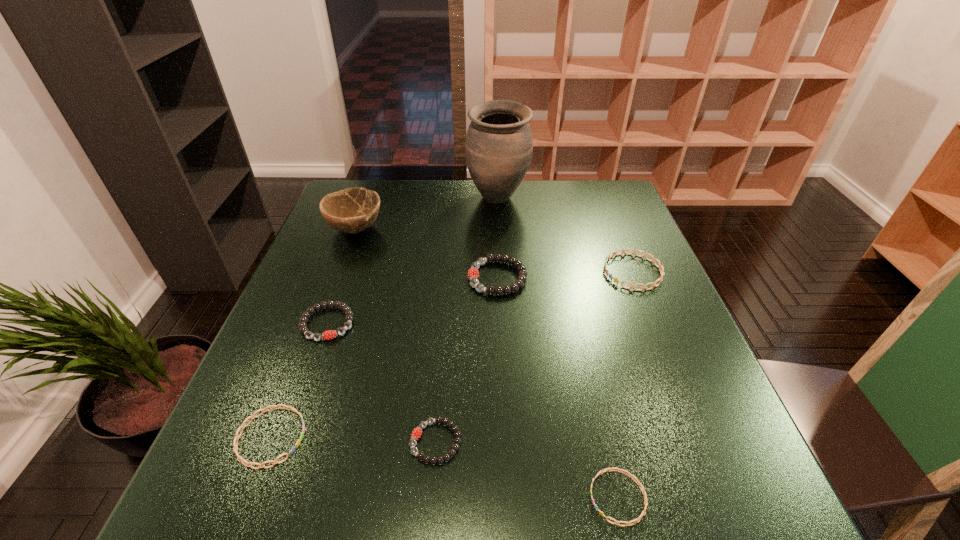
Locate an element on the screen. black bracelet that is the closest one to the smallest black bracelet is located at coordinates (303, 329).

Identify which black bracelet is the second nearest to the second nearest black bracelet. Please provide its 2D coordinates. Your answer should be formatted as a tuple, i.e. [(x, y)], where the tuple contains the x and y coordinates of a point satisfying the conditions above.

[(473, 273)]

Locate which blue bracelet ranks in proximity to the rightmost black bracelet. Please provide its 2D coordinates. Your answer should be formatted as a tuple, i.e. [(x, y)], where the tuple contains the x and y coordinates of a point satisfying the conditions above.

[(659, 266)]

Locate which blue bracelet is the second closest to the second object from right to left. Please provide its 2D coordinates. Your answer should be formatted as a tuple, i.e. [(x, y)], where the tuple contains the x and y coordinates of a point satisfying the conditions above.

[(248, 464)]